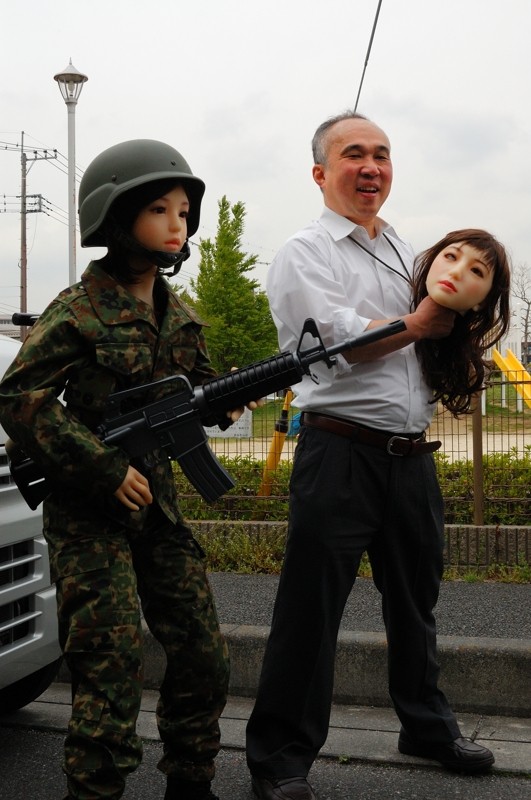
Where is `dolls`? This screenshot has width=531, height=800. dolls is located at coordinates (465, 304), (143, 346).